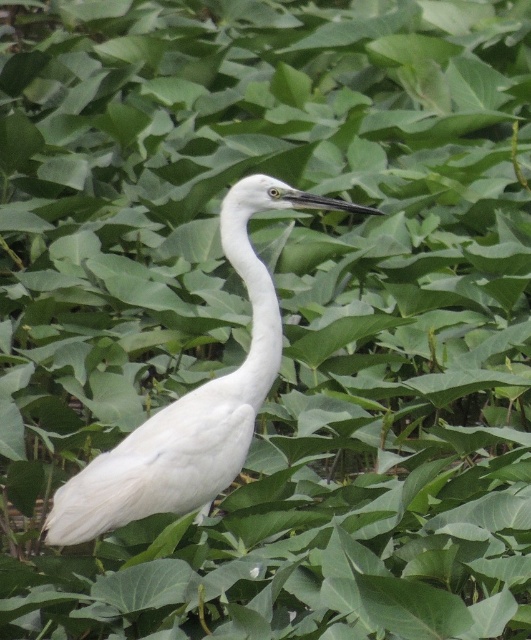
Question: Which object appears farthest from the camera in this image?

Choices:
 (A) white feathered bird at center
 (B) white smooth neck at center

Answer: (B)

Question: Is white feathered bird at center above white smooth neck at center?

Choices:
 (A) yes
 (B) no

Answer: (B)

Question: Can you confirm if white feathered bird at center is positioned above white smooth neck at center?

Choices:
 (A) yes
 (B) no

Answer: (B)

Question: Is white feathered bird at center wider than white smooth neck at center?

Choices:
 (A) yes
 (B) no

Answer: (A)